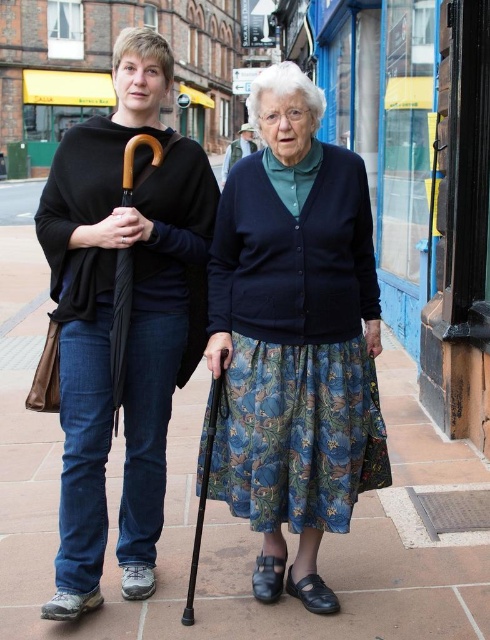
You are a photographer trying to capture a clear shot of the wooden cane at lower center. However, the blue floral skirt at center is blocking your view. Can you determine if the skirt is in front of or behind the cane?

The blue floral skirt at center is positioned over wooden cane at lower center, so the skirt is in front of the cane and blocking the view.

You are a fashion designer observing the scene. You need to determine which item is bigger between the blue floral skirt at center and the black matte umbrella at left. Which one should you choose for a design that requires a larger piece?

The blue floral skirt at center is larger in size than the black matte umbrella at left, so you should choose the blue floral skirt at center for the design that requires a larger piece.

You are a pedestrian trying to avoid getting wet in the rain. You see the blue floral skirt at center and the black matte umbrella at left. Which object is positioned higher relative to the other?

The black matte umbrella at left is positioned higher than the blue floral skirt at center because the skirt is located below the umbrella.